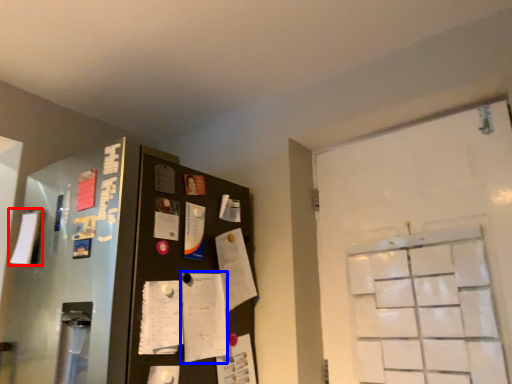
Question: Among these objects, which one is farthest to the camera, paper (highlighted by a red box) or notepad (highlighted by a blue box)?

Choices:
 (A) paper
 (B) notepad

Answer: (A)